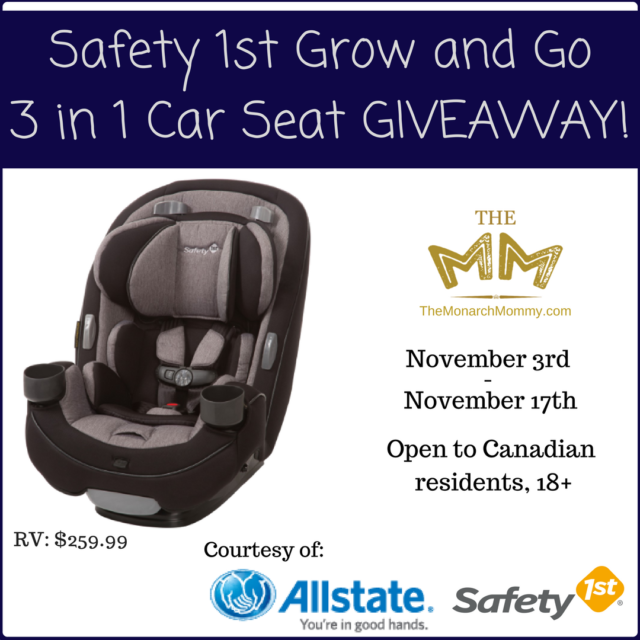
At what (x,y) coordinates should I click in order to perform the action: click on cup holder. Please return your answer as a coordinate pair (x, y). The width and height of the screenshot is (640, 640). Looking at the image, I should click on (221, 402), (36, 377).